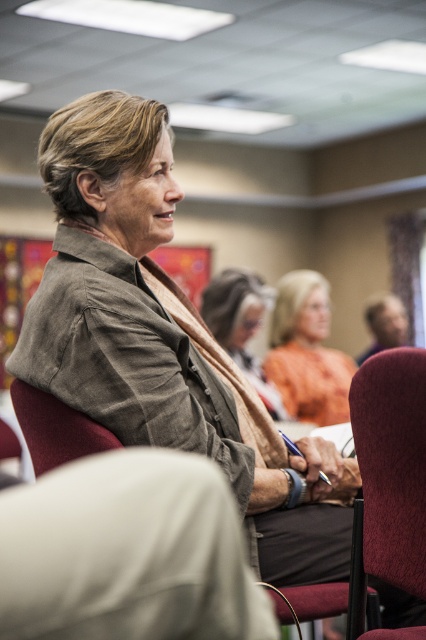
Between maroon fabric chair at lower right and maroon fabric chair at lower left, which one is positioned higher?

maroon fabric chair at lower left is higher up.

Is maroon fabric chair at lower right taller than maroon fabric chair at lower left?

Indeed, maroon fabric chair at lower right has a greater height compared to maroon fabric chair at lower left.

Where is `maroon fabric chair at lower right`? The width and height of the screenshot is (426, 640). maroon fabric chair at lower right is located at coordinates (388, 483).

Between maroon fabric chair at lower right and orange matte shirt at center, which one appears on the right side from the viewer's perspective?

orange matte shirt at center is more to the right.

Does maroon fabric chair at lower right have a greater width compared to orange matte shirt at center?

No, maroon fabric chair at lower right is not wider than orange matte shirt at center.

Which is in front, point (403, 560) or point (302, 282)?

Point (403, 560) is in front.

Identify the location of maroon fabric chair at lower right. (388, 483).

Does orange matte shirt at center have a larger size compared to light brown textured sweater at center?

Yes, orange matte shirt at center is bigger than light brown textured sweater at center.

In the scene shown: Can you confirm if orange matte shirt at center is thinner than light brown textured sweater at center?

In fact, orange matte shirt at center might be wider than light brown textured sweater at center.

Identify the location of orange matte shirt at center. This screenshot has width=426, height=640. (307, 352).

Where is `orange matte shirt at center`? orange matte shirt at center is located at coordinates click(x=307, y=352).